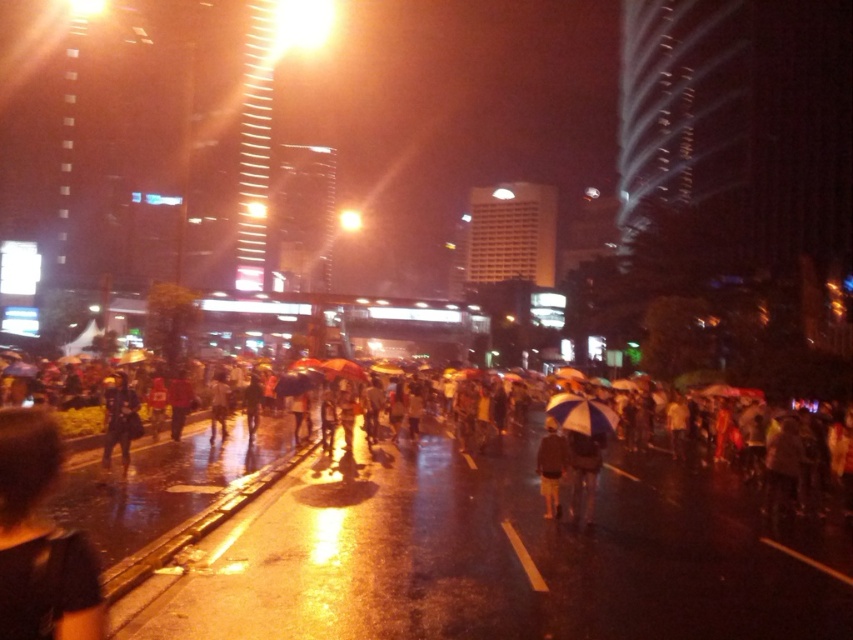
You are standing at the center of the road in the nighttime urban scene. There is a dark blue jacket at left represented by point (120, 419). Can you see the dark blue jacket at left from your current position?

Yes, the dark blue jacket at left is located at point (120, 419), which is visible from the center of the road in the nighttime urban scene.

You are a pedestrian trying to stay dry during the rain. You see a dark gray umbrella at center and a dark brown leather jacket at center. Which item is currently shielding you from the rain?

The dark gray umbrella at center is located above the dark brown leather jacket at center, so it is shielding you from the rain.

You are a photographer trying to capture a clear shot of the dark gray umbrella at center and the dark blue jacket at left. Since the rain is heavy, you need to ensure your camera is protected. Which object should you position closer to the camera to avoid water splashes from the road below?

You should position the dark gray umbrella at center closer to the camera because it is larger than the dark blue jacket at left, providing better coverage against water splashes.